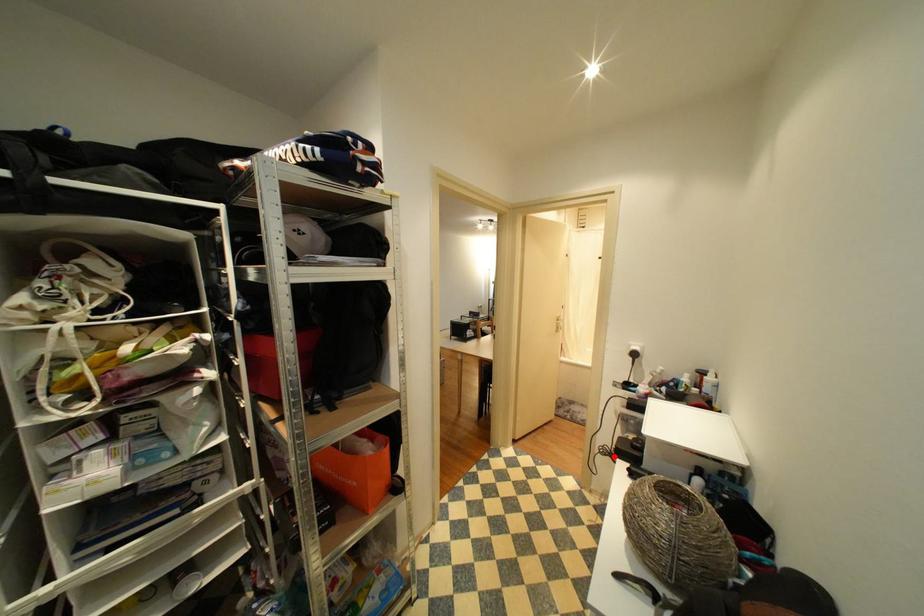
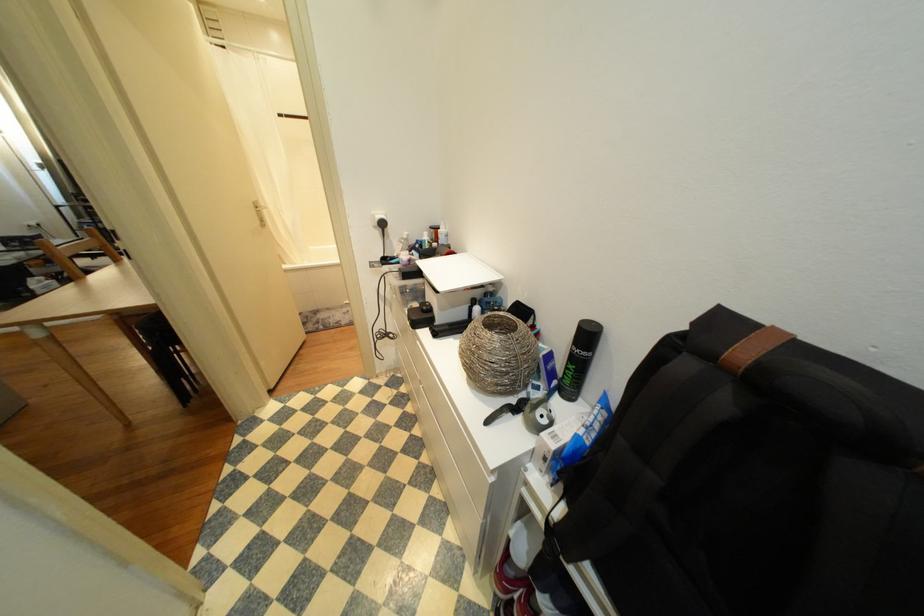
Question: A red point is marked in image1. In image2, is the corresponding 3D point closer to the camera or farther? Reply with the corresponding letter.

Choices:
 (A) The corresponding 3D point is closer.
 (B) The corresponding 3D point is farther.

Answer: (A)